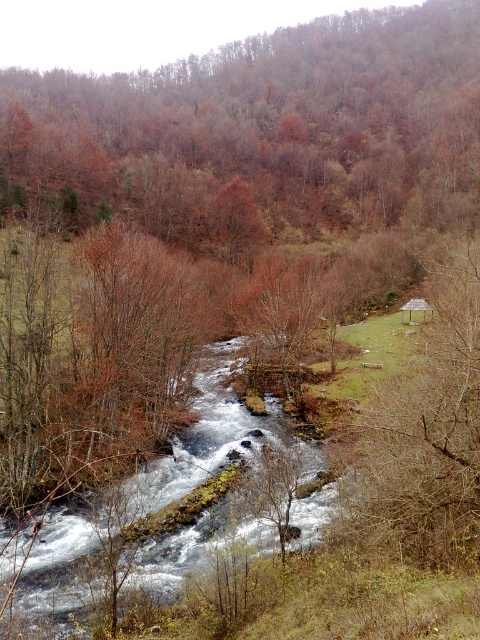
Which of these two, brown matte tree at upper center or brown leafless tree at center-right, stands shorter?

brown leafless tree at center-right is shorter.

Does brown matte tree at upper center appear over brown leafless tree at center-right?

Indeed, brown matte tree at upper center is positioned over brown leafless tree at center-right.

Locate an element on the screen. brown matte tree at upper center is located at coordinates (262, 129).